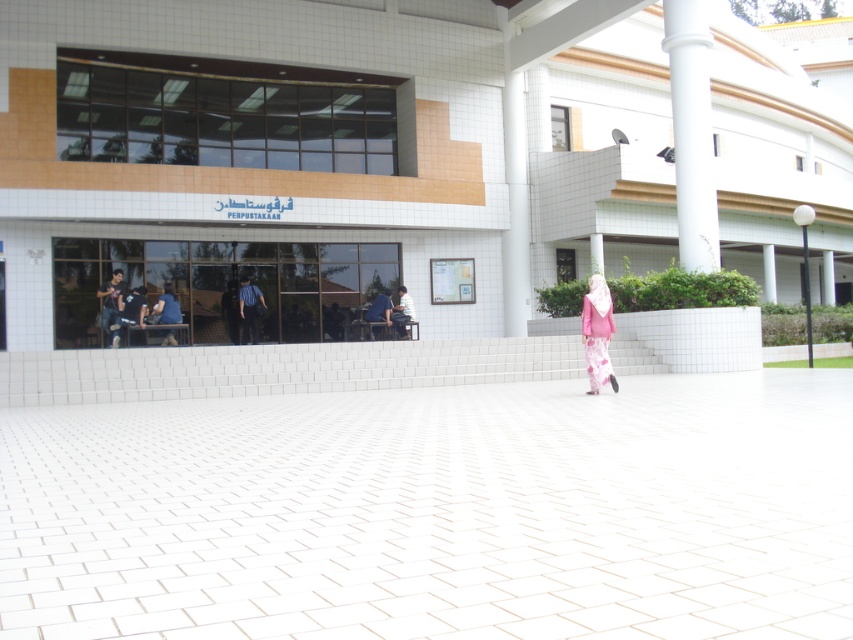
Question: Which of the following is the farthest from the observer?

Choices:
 (A) blue fabric chair at center
 (B) white tile pavement at center
 (C) white smooth column at right

Answer: (A)

Question: Where is white tile pavement at center located in relation to striped shirt at center in the image?

Choices:
 (A) below
 (B) above

Answer: (A)

Question: Does pink satin hijab at center appear on the left side of blue fabric shirt at center?

Choices:
 (A) no
 (B) yes

Answer: (A)

Question: Considering the real-world distances, which object is farthest from the striped shirt at center?

Choices:
 (A) blue fabric shirt at center
 (B) dark blue shirt at left
 (C) matte black shirt at center

Answer: (B)

Question: Which point is farther from the camera taking this photo?

Choices:
 (A) (119, 291)
 (B) (132, 291)
 (C) (161, 342)

Answer: (B)

Question: Does white tile pavement at center have a greater width compared to blue fabric chair at center?

Choices:
 (A) yes
 (B) no

Answer: (A)